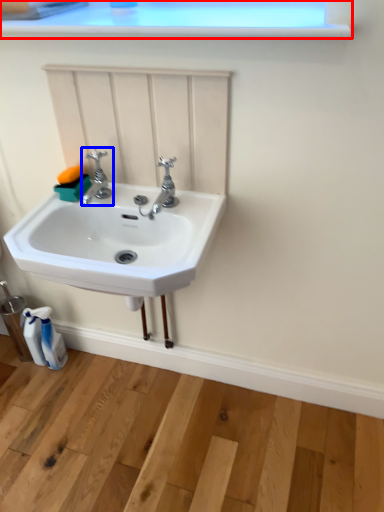
Question: Which of the following is the closest to the observer, window frame (highlighted by a red box) or tap (highlighted by a blue box)?

Choices:
 (A) window frame
 (B) tap

Answer: (A)